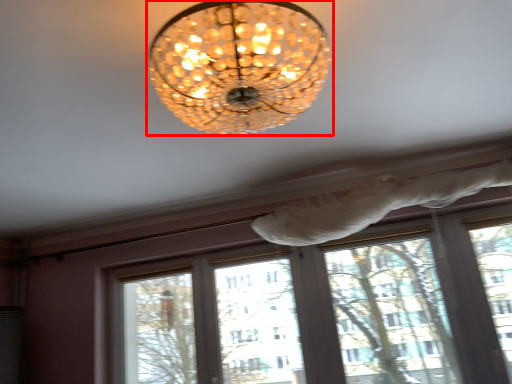
Question: From the image's perspective, where is lamp (annotated by the red box) located relative to window frame?

Choices:
 (A) above
 (B) below

Answer: (A)